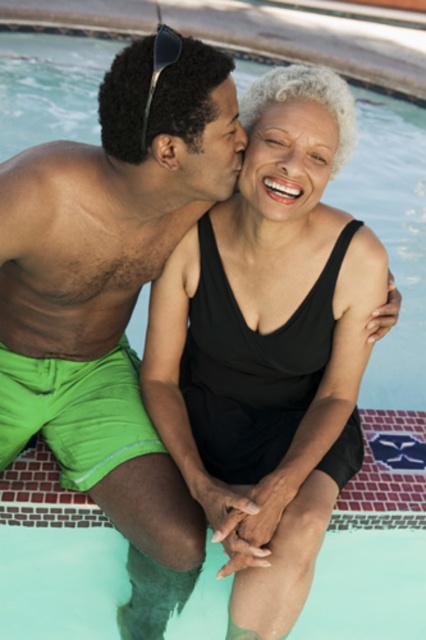
You are designing a storage box for the items in the image. The box must accommodate both the green matte shorts at left and the matte black sunglasses at upper left. Which item requires a wider compartment?

The green matte shorts at left might require a wider compartment since they are wider than the matte black sunglasses at upper left.

You are a photographer trying to capture the scene from above. You notice the green matte shorts at left and the black matte swimsuit at center. Which object is positioned lower in the image?

The green matte shorts at left are located below the black matte swimsuit at center, so the green matte shorts at left is positioned lower in the image.

You are standing at the origin point of the coordinate system in the image. The green matte shorts at left is located at point (x=111, y=288). If you want to move towards the green matte shorts at left, in which direction should you move?

The green matte shorts at left is located at point (x=111, y=288). Since the coordinate system typically has the origin at the bottom left corner, moving towards the right and upwards would bring you closer to the green matte shorts at left.